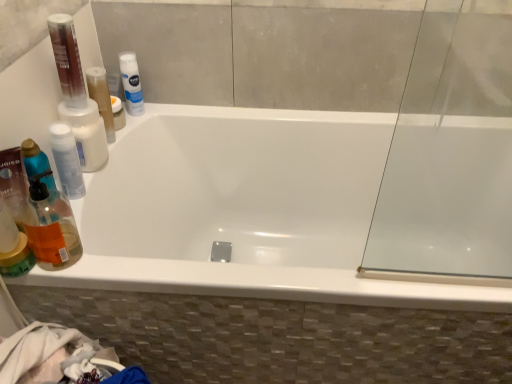
Question: Is translucent orange liquid at left completely or partially outside of white matte nivea spray at upper center, acting as the 1th mouthwash starting from the back?

Choices:
 (A) yes
 (B) no

Answer: (A)

Question: Considering the relative positions of translucent orange liquid at left and white matte nivea spray at upper center, which is the 3th mouthwash in front-to-back order, in the image provided, is translucent orange liquid at left behind white matte nivea spray at upper center, which is the 3th mouthwash in front-to-back order,?

Choices:
 (A) no
 (B) yes

Answer: (A)

Question: Does translucent orange liquid at left have a greater height compared to white matte nivea spray at upper center, acting as the 1th mouthwash starting from the back?

Choices:
 (A) no
 (B) yes

Answer: (A)

Question: Is translucent orange liquid at left bigger than white matte nivea spray at upper center, acting as the 1th mouthwash starting from the back?

Choices:
 (A) no
 (B) yes

Answer: (B)

Question: Is translucent orange liquid at left wider than white matte nivea spray at upper center, acting as the 1th mouthwash starting from the back?

Choices:
 (A) yes
 (B) no

Answer: (A)

Question: Would you say translucent orange liquid at left is a long distance from white matte nivea spray at upper center, which is the 3th mouthwash in front-to-back order?

Choices:
 (A) yes
 (B) no

Answer: (B)

Question: Is white matte nivea spray at upper center, acting as the 1th mouthwash starting from the back, far from translucent orange liquid at left?

Choices:
 (A) no
 (B) yes

Answer: (A)

Question: Is white matte nivea spray at upper center, acting as the 1th mouthwash starting from the back, at the right side of translucent orange liquid at left?

Choices:
 (A) no
 (B) yes

Answer: (B)

Question: Can you confirm if white matte nivea spray at upper center, which is the 3th mouthwash in front-to-back order, is thinner than translucent orange liquid at left?

Choices:
 (A) no
 (B) yes

Answer: (B)

Question: Is white matte nivea spray at upper center, acting as the 1th mouthwash starting from the back, positioned in front of translucent orange liquid at left?

Choices:
 (A) no
 (B) yes

Answer: (A)

Question: Considering the relative sizes of white matte nivea spray at upper center, which is the 3th mouthwash in front-to-back order, and translucent orange liquid at left in the image provided, is white matte nivea spray at upper center, which is the 3th mouthwash in front-to-back order, smaller than translucent orange liquid at left?

Choices:
 (A) yes
 (B) no

Answer: (A)

Question: Is white matte nivea spray at upper center, acting as the 1th mouthwash starting from the back, turned away from translucent orange liquid at left?

Choices:
 (A) yes
 (B) no

Answer: (B)

Question: Is translucent orange liquid at left touching white glossy bathtub at center?

Choices:
 (A) no
 (B) yes

Answer: (A)